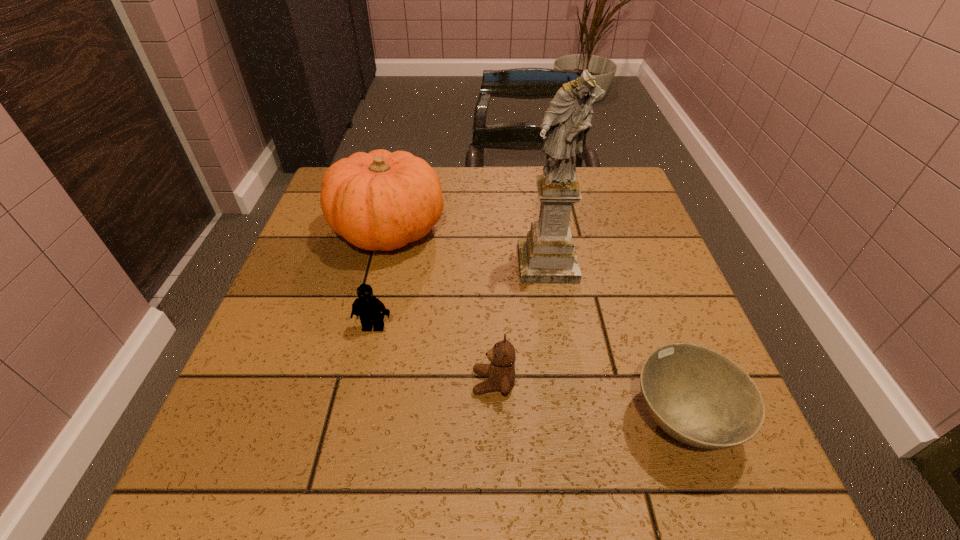
The width and height of the screenshot is (960, 540). I want to click on vacant point at the far edge, so click(x=509, y=179).

You are a GUI agent. You are given a task and a screenshot of the screen. Output one action in this format:
    pyautogui.click(x=<x>, y=<y>)
    Task: Click on the vacant space at the near edge
    This screenshot has width=960, height=540.
    Given the screenshot: What is the action you would take?
    pyautogui.click(x=398, y=494)

You are a GUI agent. You are given a task and a screenshot of the screen. Output one action in this format:
    pyautogui.click(x=<x>, y=<y>)
    Task: Click on the vacant space at the left edge of the desktop
    The width and height of the screenshot is (960, 540).
    Given the screenshot: What is the action you would take?
    pyautogui.click(x=331, y=292)

Image resolution: width=960 pixels, height=540 pixels. What are the coordinates of `vacant space at the far right corner` in the screenshot? It's located at (590, 190).

In the image, there is a desktop. Identify the location of blank space at the near right corner. (741, 478).

This screenshot has width=960, height=540. In order to click on vacant space that is in between the third object from left to right and the fourth object from left to right in this screenshot , I will do `click(520, 322)`.

Where is `free spot between the fourth shortest object and the teddy bear`? free spot between the fourth shortest object and the teddy bear is located at coordinates (441, 306).

What are the coordinates of `unoccupied position between the Lego and the tallest object` in the screenshot? It's located at (460, 295).

Find the location of `unoccupied position between the Lego and the tallest object`. unoccupied position between the Lego and the tallest object is located at coordinates (460, 295).

At what (x,y) coordinates should I click in order to perform the action: click on free space between the shortest object and the third object from right to left. Please return your answer as a coordinate pair (x, y). Looking at the image, I should click on (588, 401).